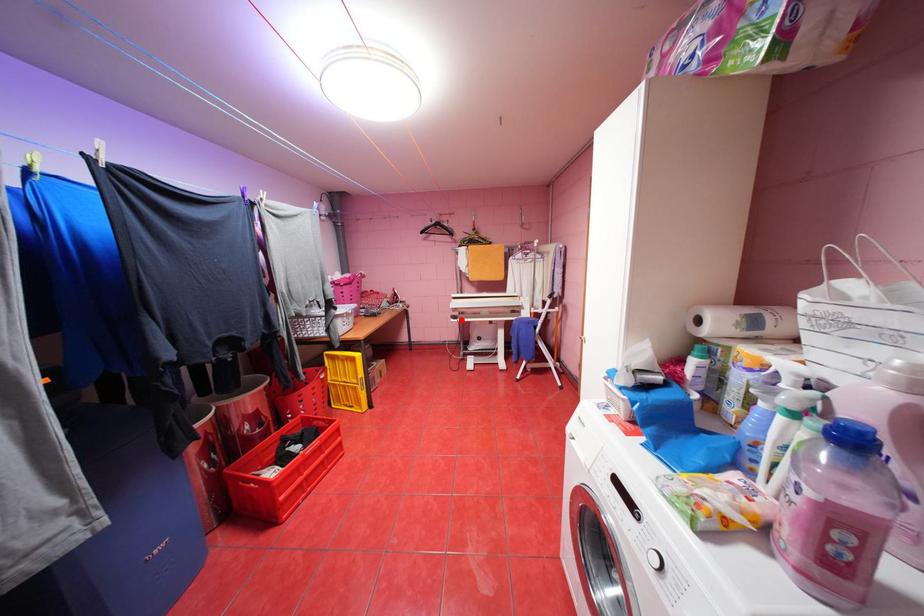
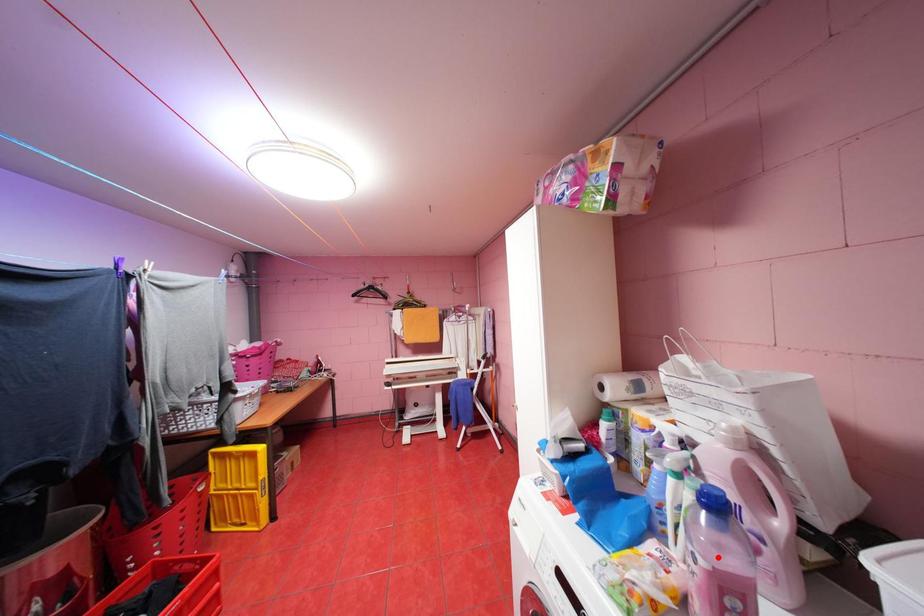
I am providing you with two images of the same scene from different viewpoints. A red point is marked on the first image and another point is marked on the second image. Is the marked point in image1 the same physical position as the marked point in image2?

No